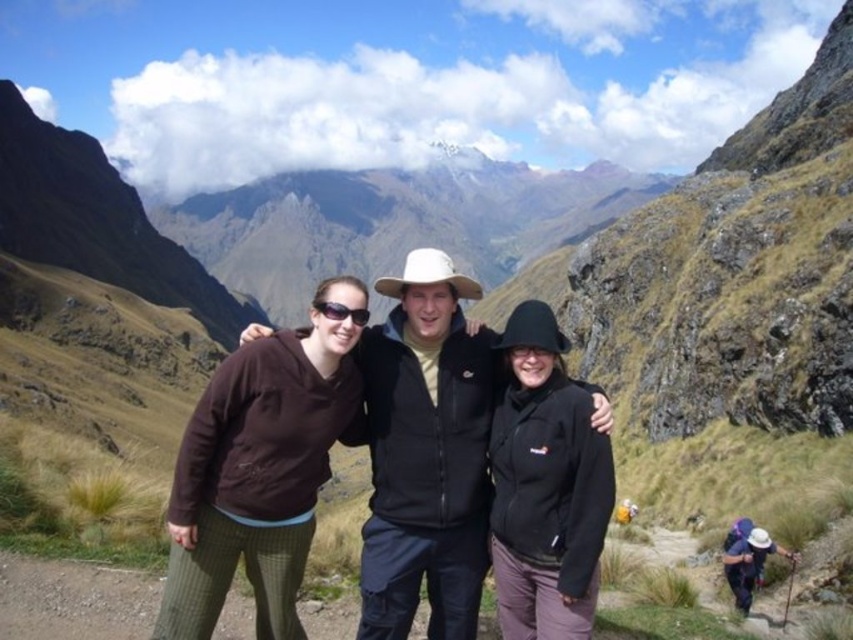
You are an observer looking at the group of hikers. Both the black matte jacket at center and the black fleece jacket at center are visible. Which one is positioned higher on the person wearing them?

The black matte jacket at center is located above the black fleece jacket at center, so it is positioned higher on the person wearing them.

You are a photographer standing on the dirt path and want to capture a photo of the two people wearing the brown fleece at center and the black matte jacket at center. If your camera has a maximum focus range of 15 feet, will you be able to capture both subjects clearly in the same frame?

The brown fleece at center and black matte jacket at center are 16.98 feet apart, which exceeds the camera maximum focus range of 15 feet. Therefore, you cannot capture both subjects clearly in the same frame.

You are a photographer who wants to ensure both jackets are visible in the photo. Since the black matte jacket at center and the black fleece jacket at center are both at the center, will the larger jacket block the smaller one from view?

The black matte jacket at center is larger in size than the black fleece jacket at center, so it might block the smaller jacket from view unless positioned carefully.